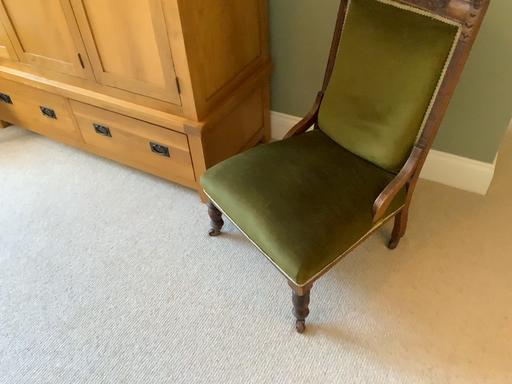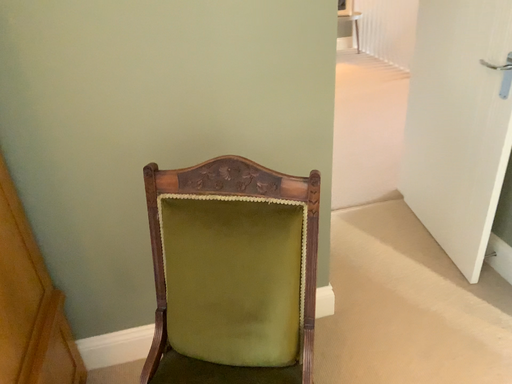
Question: How did the camera likely rotate when shooting the video?

Choices:
 (A) rotated right
 (B) rotated left

Answer: (A)